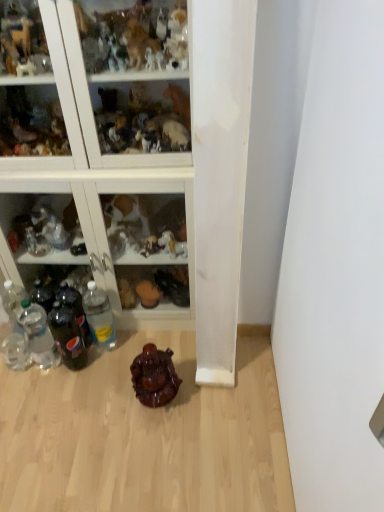
This screenshot has width=384, height=512. Find the location of `empty space that is to the right of dark glass bottle at lower left, the second bottle in the right-to-left sequence`. empty space that is to the right of dark glass bottle at lower left, the second bottle in the right-to-left sequence is located at coordinates (115, 366).